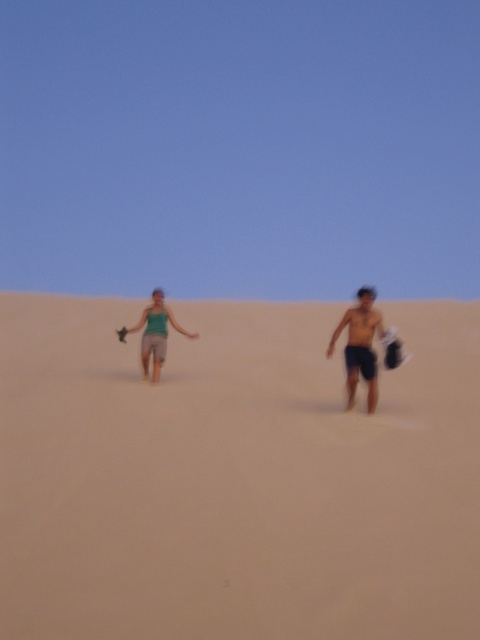
You are a photographer trying to capture the perfect shot of the two people walking on the dunes. You want to focus on the shiny black shorts at center located at point (x=360, y=346). What should you adjust in your camera frame to ensure the shiny black shorts at center is centered in your photo?

To center the shiny black shorts at center located at point (x=360, y=346) in your photo, adjust your camera frame so that the point (x=360, y=346) is positioned exactly at the center of your viewfinder or screen. This will ensure the shiny black shorts at center is the focal point of the image.

You are a drone operator trying to capture aerial footage of two people walking across the sand dunes. You need to position your drone to focus on both individuals. Given their positions at points point (369, 602) and point (372, 365), which point should you prioritize to ensure the drone stays ahead of their path?

Point (369, 602) should be prioritized because it is in front of point (372, 365), meaning the drone should focus on that position to stay ahead of their path.